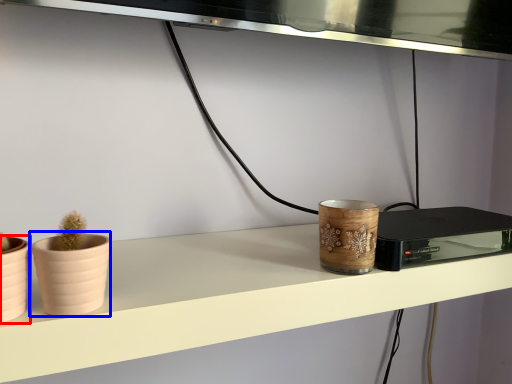
Question: Which point is further to the camera, flowerpot (highlighted by a red box) or flowerpot (highlighted by a blue box)?

Choices:
 (A) flowerpot
 (B) flowerpot

Answer: (B)